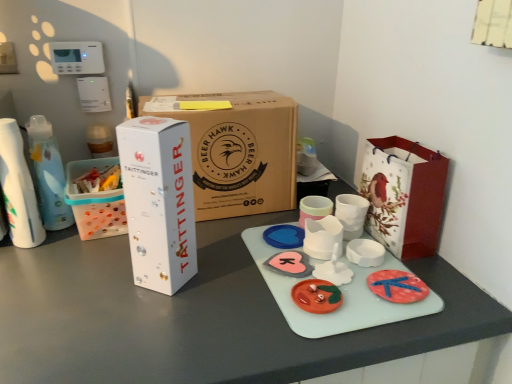
Identify the location of free space in front of white paper bag with red bird design at right. (432, 286).